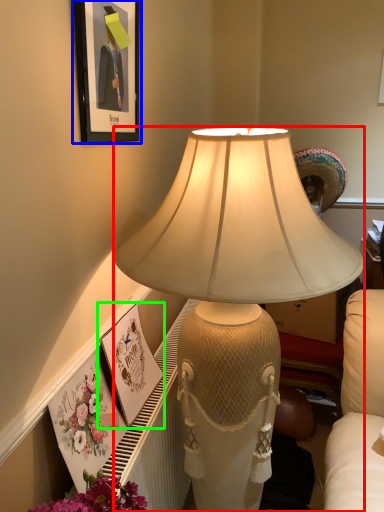
Question: Which object is the farthest from lamp (highlighted by a red box)? Choose among these: picture frame (highlighted by a blue box) or picture frame (highlighted by a green box).

Choices:
 (A) picture frame
 (B) picture frame

Answer: (B)